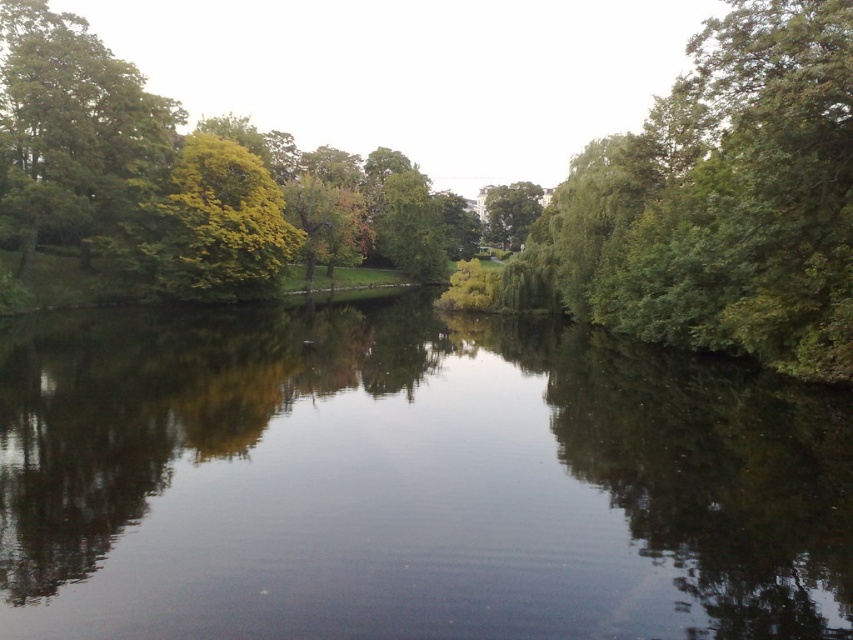
You are standing at the edge of the water and want to take a photo of both the smooth reflective water at center and the green leafy tree at upper left. Which object will appear larger in the photo?

The smooth reflective water at center will appear larger in the photo because it is closer to the viewer than the green leafy tree at upper left.

You are standing at the edge of the lake and see two points marked in the image. The first point is at coordinates point (741, 465) and the second point is at point (78, 182). Which point is closer to you?

Point (741, 465) is in front of point (78, 182), so it is closer to you.

You are standing at the edge of the water and see the green leafy tree at center and the green leafy tree at upper left. Which tree is closer to you?

The green leafy tree at center is closer to you because it is positioned in front of the green leafy tree at upper left.